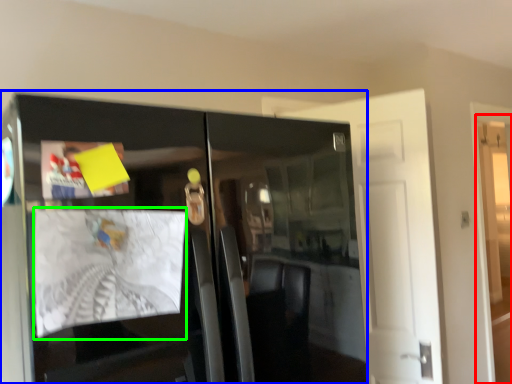
Question: Which object is positioned farthest from door (highlighted by a red box)? Select from cabinetry (highlighted by a blue box) and magazine (highlighted by a green box).

Choices:
 (A) cabinetry
 (B) magazine

Answer: (B)